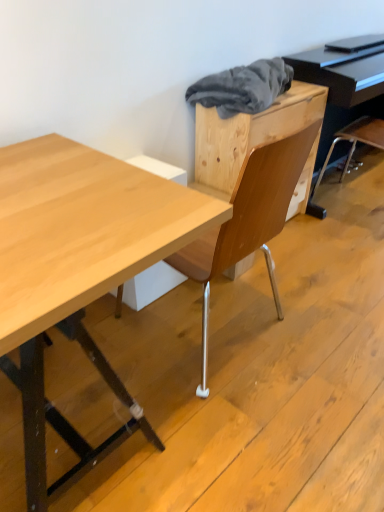
Question: Does gray fabric at upper center have a lesser width compared to natural wood desk at center?

Choices:
 (A) no
 (B) yes

Answer: (B)

Question: Considering the relative positions of gray fabric at upper center and natural wood desk at center in the image provided, is gray fabric at upper center in front of natural wood desk at center?

Choices:
 (A) yes
 (B) no

Answer: (B)

Question: Does gray fabric at upper center have a lesser height compared to natural wood desk at center?

Choices:
 (A) no
 (B) yes

Answer: (A)

Question: Is gray fabric at upper center further to the viewer compared to natural wood desk at center?

Choices:
 (A) no
 (B) yes

Answer: (B)

Question: From the image's perspective, would you say gray fabric at upper center is shown under natural wood desk at center?

Choices:
 (A) yes
 (B) no

Answer: (B)

Question: Looking at their shapes, would you say black glossy piano at upper right is wider or thinner than gray fabric at upper center?

Choices:
 (A) wide
 (B) thin

Answer: (A)

Question: Is black glossy piano at upper right in front of or behind gray fabric at upper center in the image?

Choices:
 (A) front
 (B) behind

Answer: (B)

Question: Considering the positions of black glossy piano at upper right and gray fabric at upper center in the image, is black glossy piano at upper right taller or shorter than gray fabric at upper center?

Choices:
 (A) short
 (B) tall

Answer: (B)

Question: In terms of size, does black glossy piano at upper right appear bigger or smaller than gray fabric at upper center?

Choices:
 (A) big
 (B) small

Answer: (A)

Question: Visually, is natural wood desk at center positioned to the left or to the right of black glossy piano at upper right?

Choices:
 (A) left
 (B) right

Answer: (A)

Question: Considering the positions of natural wood desk at center and black glossy piano at upper right in the image, is natural wood desk at center wider or thinner than black glossy piano at upper right?

Choices:
 (A) wide
 (B) thin

Answer: (A)

Question: Is natural wood desk at center bigger or smaller than black glossy piano at upper right?

Choices:
 (A) big
 (B) small

Answer: (A)

Question: In the image, is natural wood desk at center positioned in front of or behind black glossy piano at upper right?

Choices:
 (A) front
 (B) behind

Answer: (A)

Question: From the image's perspective, is gray fabric at upper center above or below natural wood desk at center?

Choices:
 (A) below
 (B) above

Answer: (B)

Question: Is gray fabric at upper center taller or shorter than natural wood desk at center?

Choices:
 (A) short
 (B) tall

Answer: (B)